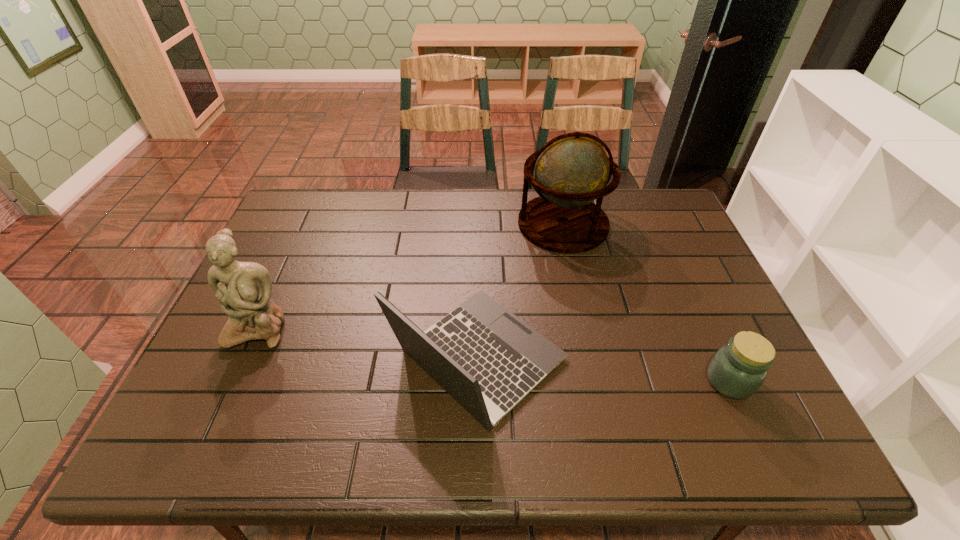
Locate an element on the screen. This screenshot has height=540, width=960. the farthest object is located at coordinates pyautogui.click(x=571, y=170).

Where is `figurine`? The width and height of the screenshot is (960, 540). figurine is located at coordinates (244, 289).

You are a GUI agent. You are given a task and a screenshot of the screen. Output one action in this format:
    pyautogui.click(x=<x>, y=<y>)
    Task: Click on the laptop_computer
    This screenshot has width=960, height=540.
    Given the screenshot: What is the action you would take?
    pyautogui.click(x=485, y=357)

Locate an element on the screen. The width and height of the screenshot is (960, 540). the shortest object is located at coordinates (737, 370).

I want to click on the rightmost object, so click(737, 370).

Find the location of a particular element. vacant space situated 0.240m on the front-facing side of the farthest object is located at coordinates (445, 224).

Identify the location of free space located on the front-facing side of the farthest object. This screenshot has height=540, width=960. (408, 224).

Where is `free location located 0.140m on the front-facing side of the farthest object`? The height and width of the screenshot is (540, 960). free location located 0.140m on the front-facing side of the farthest object is located at coordinates (475, 224).

Identify the location of free space located on the front-facing side of the leftmost object. The image size is (960, 540). (211, 432).

At what (x,y) coordinates should I click in order to perform the action: click on free location located at the front screen of the laptop_computer. Please return your answer as a coordinate pair (x, y). This screenshot has width=960, height=540. Looking at the image, I should click on (719, 359).